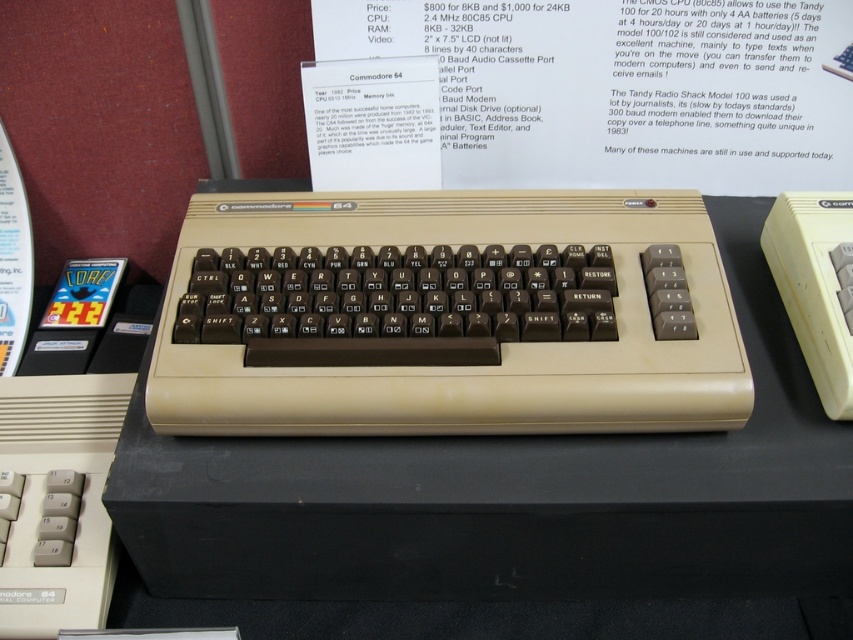
You are a museum visitor standing in front of the vintage Commodore 64 computer. You notice a point at coordinates (x=445, y=316). What object is located at that point?

The beige plastic keyboard at center is located at point (x=445, y=316).

You are a museum visitor standing in front of the beige plastic table at center and the beige plastic keyboard at center. Which object is taller?

The beige plastic table at center is taller than the beige plastic keyboard at center.

You are a museum visitor standing in front of the beige plastic keyboard at center and the beige plastic table at center. Which object is positioned to the right?

The beige plastic table at center is positioned to the right of the beige plastic keyboard at center.